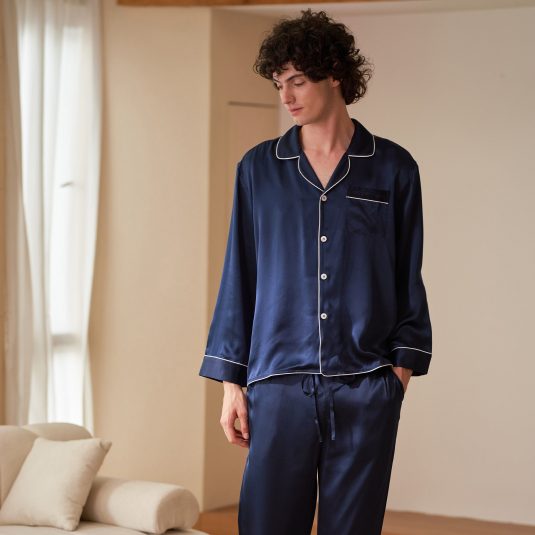
Locate an element on the screen. The image size is (535, 535). chest is located at coordinates (326, 171).